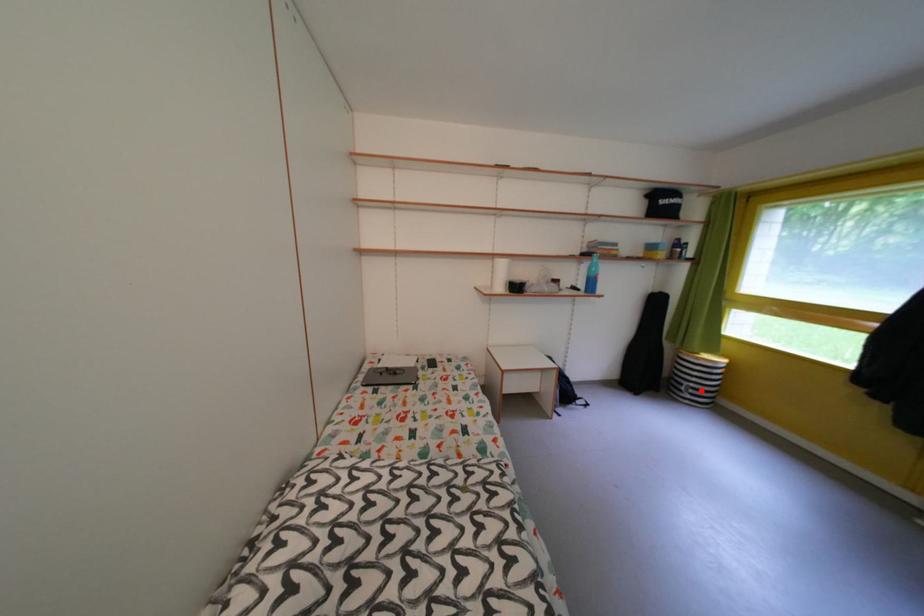
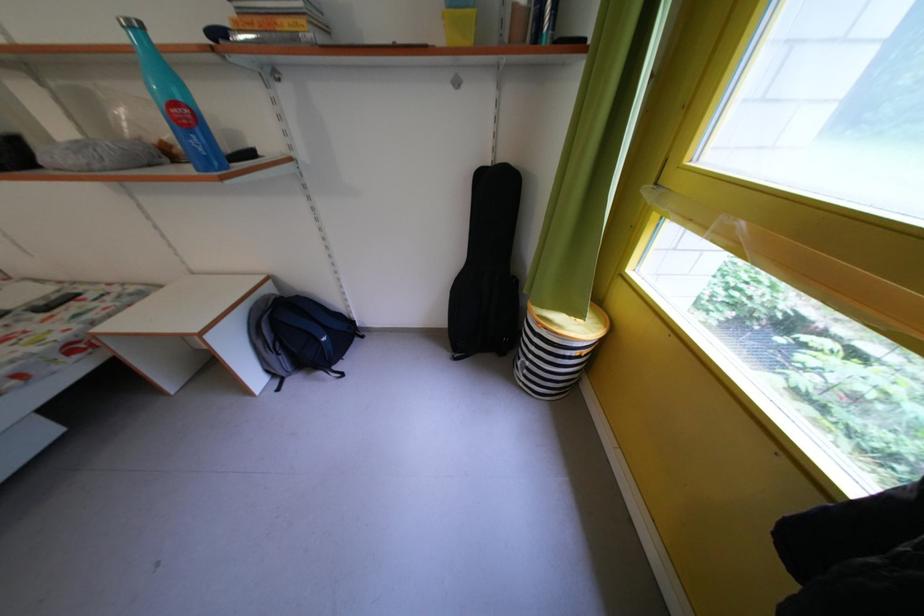
Question: I am providing you with two images of the same scene from different viewpoints. Image1 has a red point marked. In image2, the corresponding 3D location appears at what relative position? Reply with the corresponding letter.

Choices:
 (A) Closer
 (B) Farther

Answer: (A)